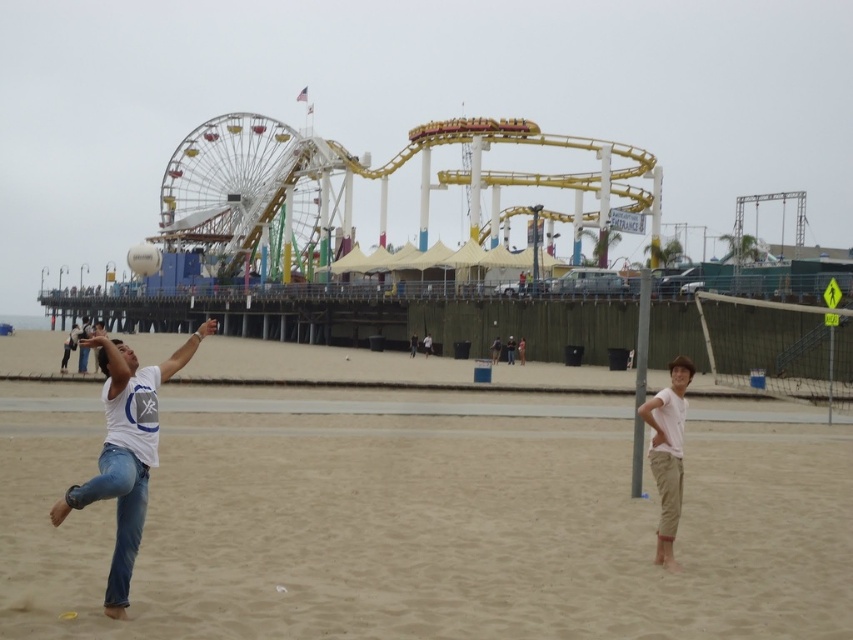
Question: Is white matte t-shirt at center wider than white cotton shirt at lower right?

Choices:
 (A) yes
 (B) no

Answer: (A)

Question: Which object is positioned closest to the light brown sand at center?

Choices:
 (A) white cotton shirt at lower right
 (B) white matte t-shirt at center
 (C) white matte t-shirt at left
 (D) white matte volleyball at center

Answer: (B)

Question: Is light brown sand at center closer to the viewer compared to white matte t-shirt at center?

Choices:
 (A) no
 (B) yes

Answer: (B)

Question: Which object appears closest to the camera in this image?

Choices:
 (A) white matte t-shirt at center
 (B) white matte t-shirt at left

Answer: (A)

Question: Does white cotton shirt at lower right lie behind white matte volleyball at center?

Choices:
 (A) yes
 (B) no

Answer: (B)

Question: Which point appears farthest from the camera in this image?

Choices:
 (A) (137, 269)
 (B) (109, 376)
 (C) (387, 608)

Answer: (A)